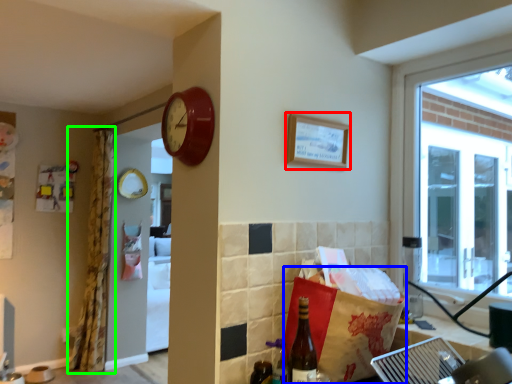
Question: Which is farther away from picture frame (highlighted by a red box)? shopping bag (highlighted by a blue box) or curtain (highlighted by a green box)?

Choices:
 (A) shopping bag
 (B) curtain

Answer: (B)